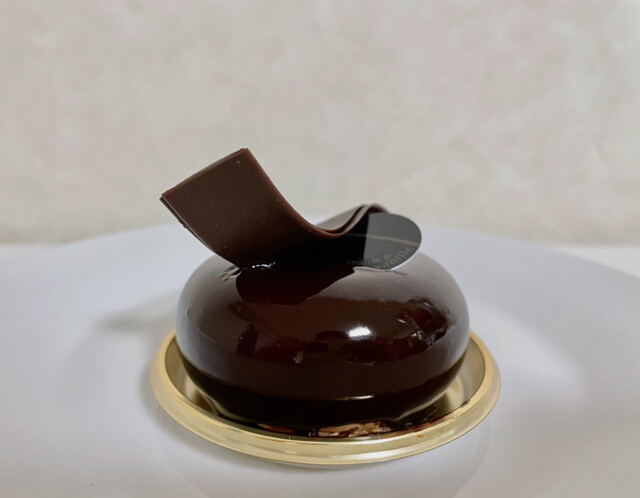
Image resolution: width=640 pixels, height=498 pixels. In order to click on gold small plate in this screenshot , I will do `click(418, 436)`.